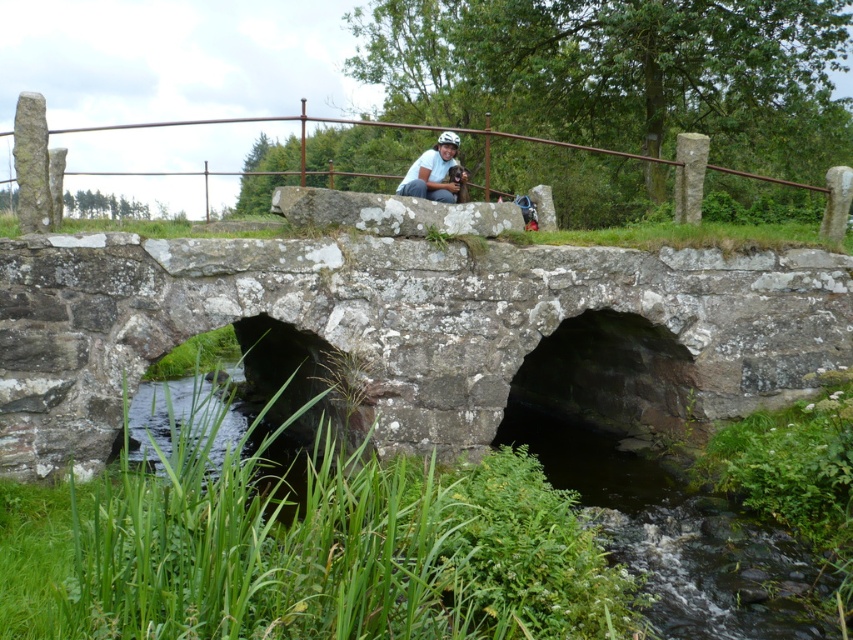
Is point (109, 124) positioned after point (438, 195)?

Yes, point (109, 124) is farther from viewer.

Does metallic brown rail at upper center have a greater width compared to matte white helmet at center?

Yes, metallic brown rail at upper center is wider than matte white helmet at center.

This screenshot has height=640, width=853. Describe the element at coordinates (132, 170) in the screenshot. I see `metallic brown rail at upper center` at that location.

Image resolution: width=853 pixels, height=640 pixels. I want to click on metallic brown rail at upper center, so click(x=132, y=170).

The height and width of the screenshot is (640, 853). Find the location of `rusty stone bridge at center`. rusty stone bridge at center is located at coordinates (413, 332).

How distant is rusty stone bridge at center from matte white helmet at center?

The distance of rusty stone bridge at center from matte white helmet at center is 12.50 feet.

Is point (700, 384) less distant than point (437, 170)?

That is True.

I want to click on rusty stone bridge at center, so click(413, 332).

Is rusty stone bridge at center positioned at the back of metallic brown rail at upper center?

No, rusty stone bridge at center is in front of metallic brown rail at upper center.

Does rusty stone bridge at center have a lesser width compared to metallic brown rail at upper center?

Correct, rusty stone bridge at center's width is less than metallic brown rail at upper center's.

Which is in front, point (556, 280) or point (16, 113)?

Point (16, 113) is in front.

Identify the location of rusty stone bridge at center. (413, 332).